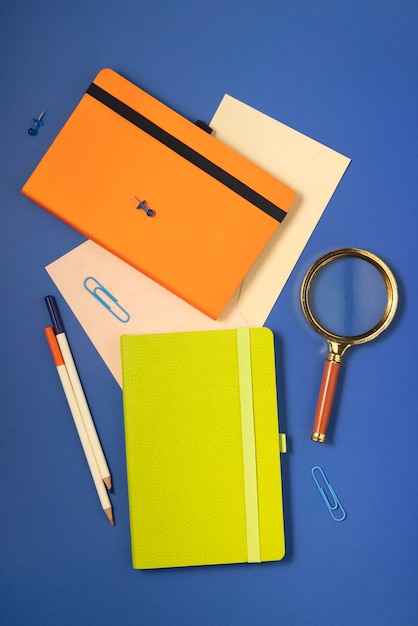
At what (x,y) coordinates should I click in order to perform the action: click on thumb tack. Please return your answer as a coordinate pair (x, y). This screenshot has height=626, width=418. Looking at the image, I should click on (144, 207), (32, 130).